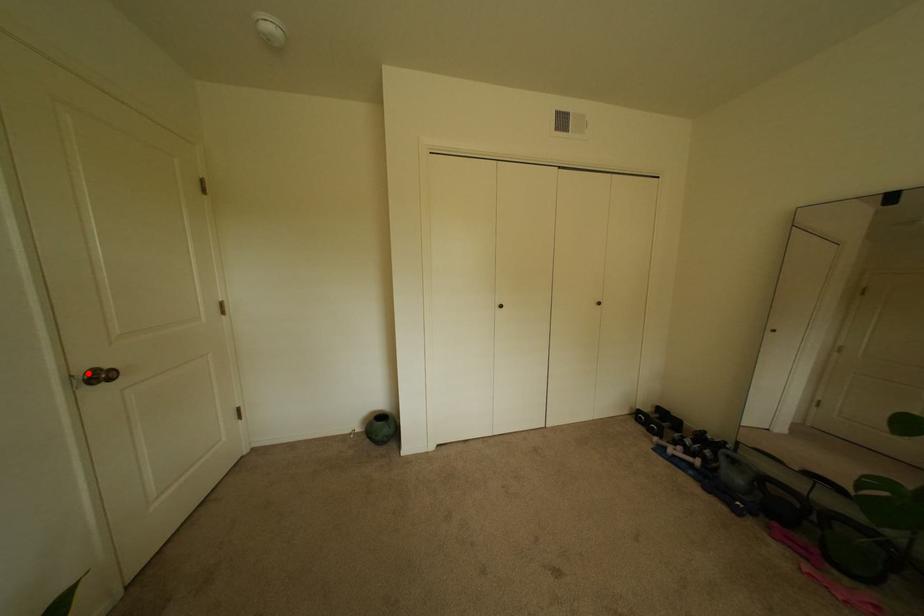
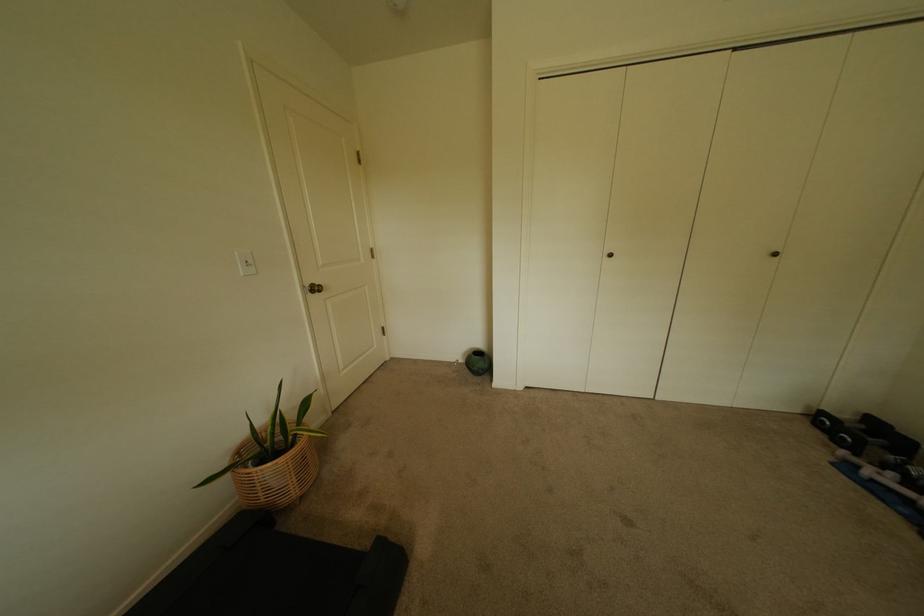
Question: I am providing you with two images of the same scene from different viewpoints. A red point is shown in image1. For the corresponding object point in image2, is it positioned nearer or farther from the camera?

Choices:
 (A) Nearer
 (B) Farther

Answer: (A)